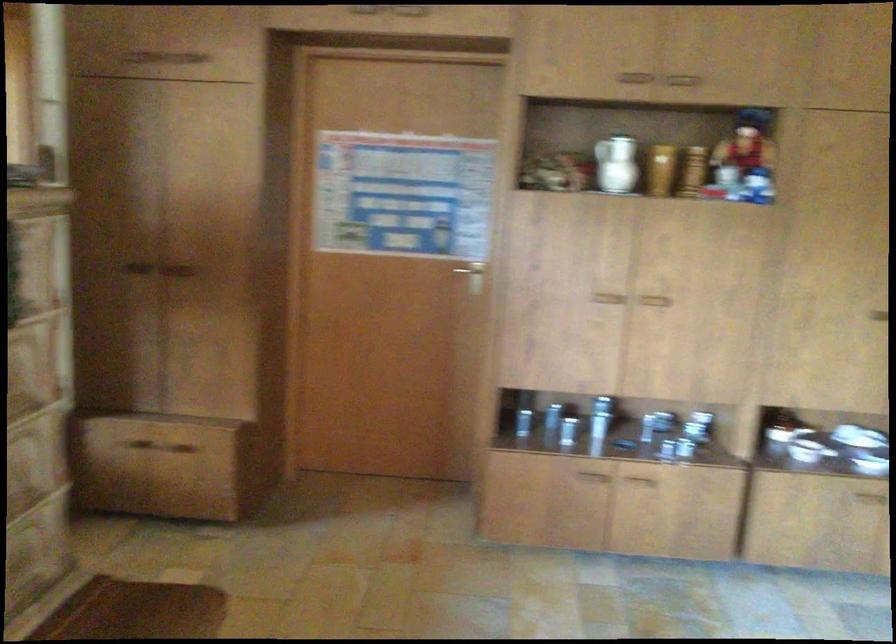
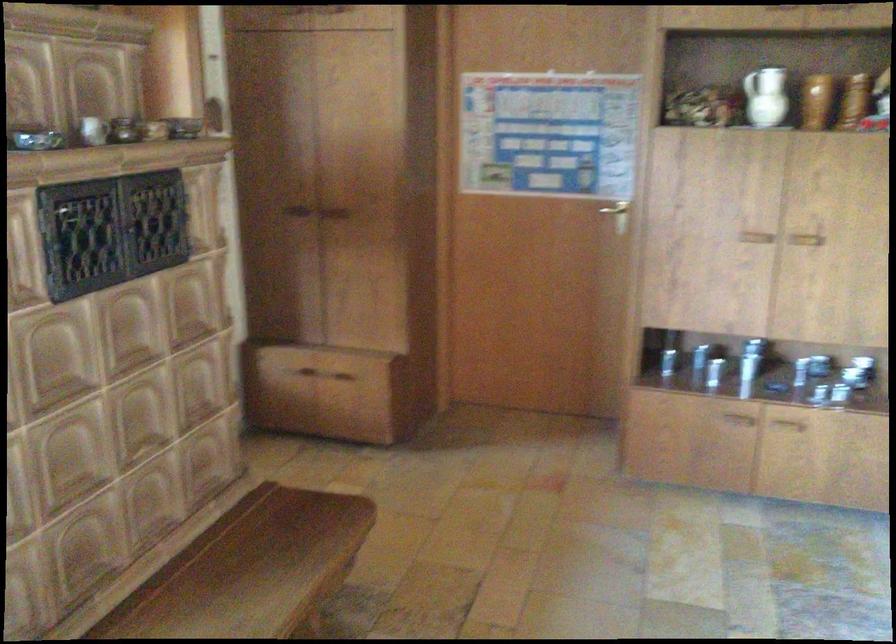
Find the pixel in the second image that matches (177,256) in the first image.

(333, 200)